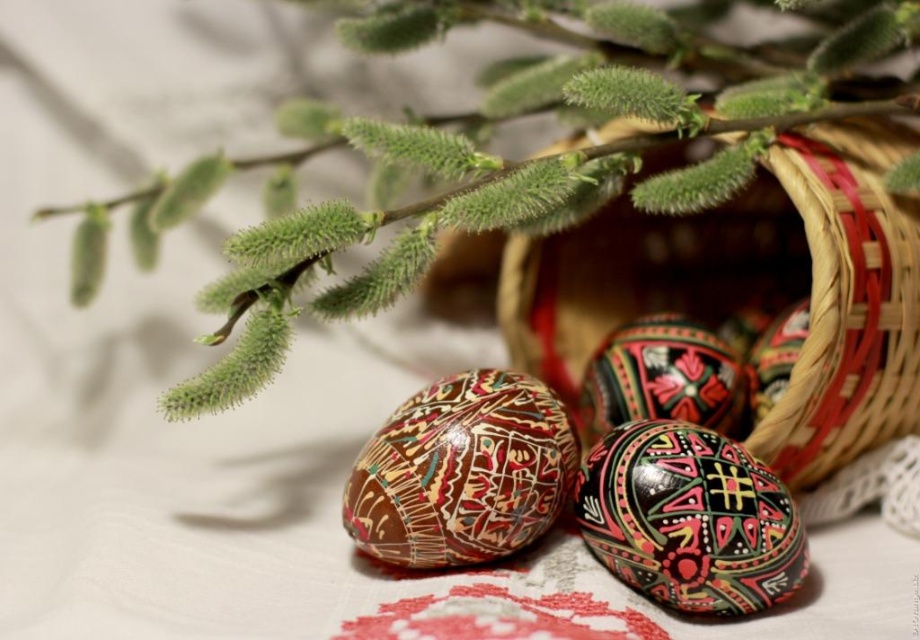
Can you confirm if brown glossy easter egg at center is positioned to the left of multicolored glossy egg at center?

Yes, brown glossy easter egg at center is to the left of multicolored glossy egg at center.

Between brown glossy easter egg at center and multicolored glossy egg at center, which one appears on the right side from the viewer's perspective?

multicolored glossy egg at center is more to the right.

Identify the location of brown glossy easter egg at center. This screenshot has width=920, height=640. (462, 472).

Consider the image. Can you confirm if brown woven basket at center is positioned to the right of brown glossy easter egg at center?

Indeed, brown woven basket at center is positioned on the right side of brown glossy easter egg at center.

Is brown woven basket at center shorter than brown glossy easter egg at center?

No, brown woven basket at center is not shorter than brown glossy easter egg at center.

At what (x,y) coordinates should I click in order to perform the action: click on brown woven basket at center. Please return your answer as a coordinate pair (x, y). Looking at the image, I should click on (753, 289).

Is green fuzzy branch at upper center further to camera compared to brown woven basket at center?

No, it is not.

Between green fuzzy branch at upper center and brown woven basket at center, which one has less height?

brown woven basket at center is shorter.

Locate an element on the screen. green fuzzy branch at upper center is located at coordinates (501, 157).